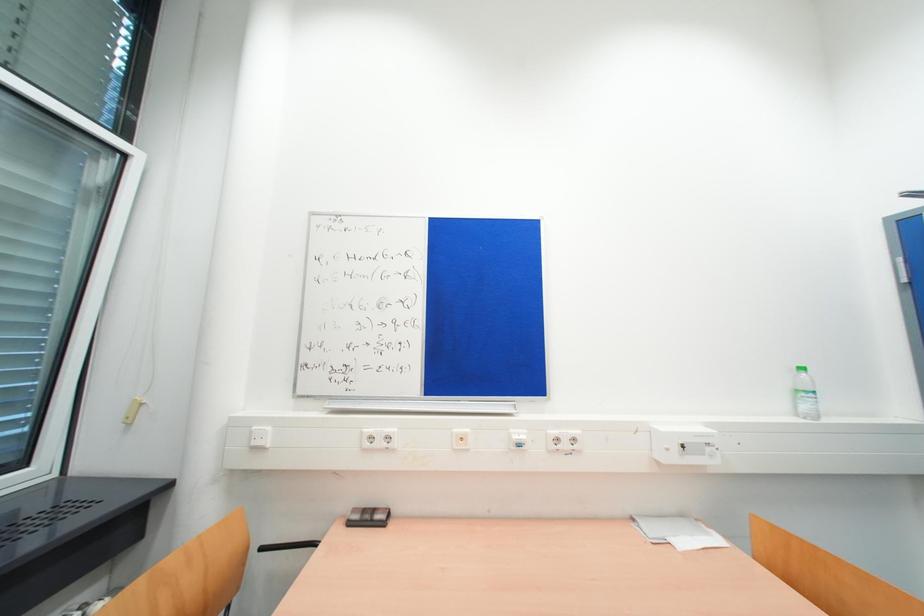
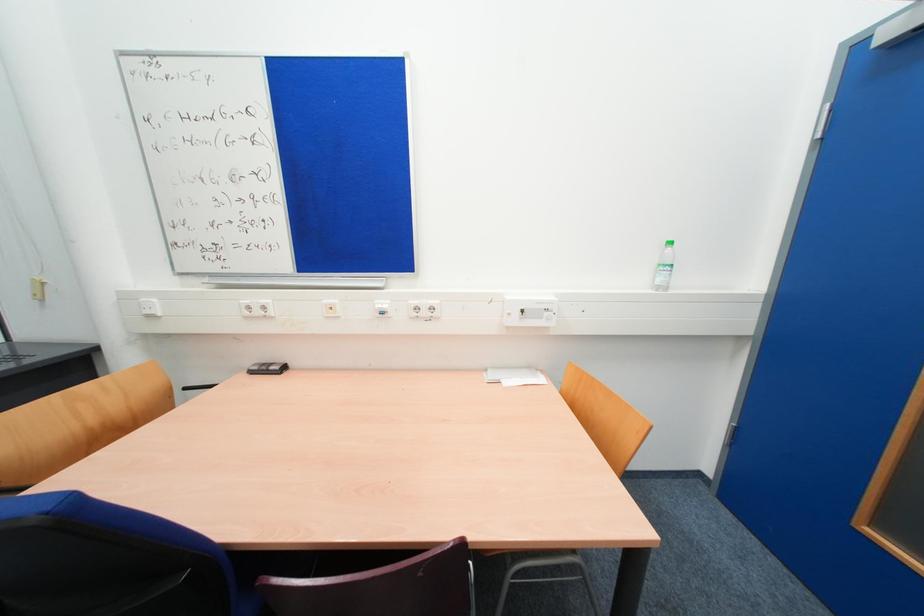
Question: Based on the continuous images, in which direction is the camera rotating? Reply with the corresponding letter.

Choices:
 (A) Left
 (B) Right
 (C) Up
 (D) Down

Answer: (D)